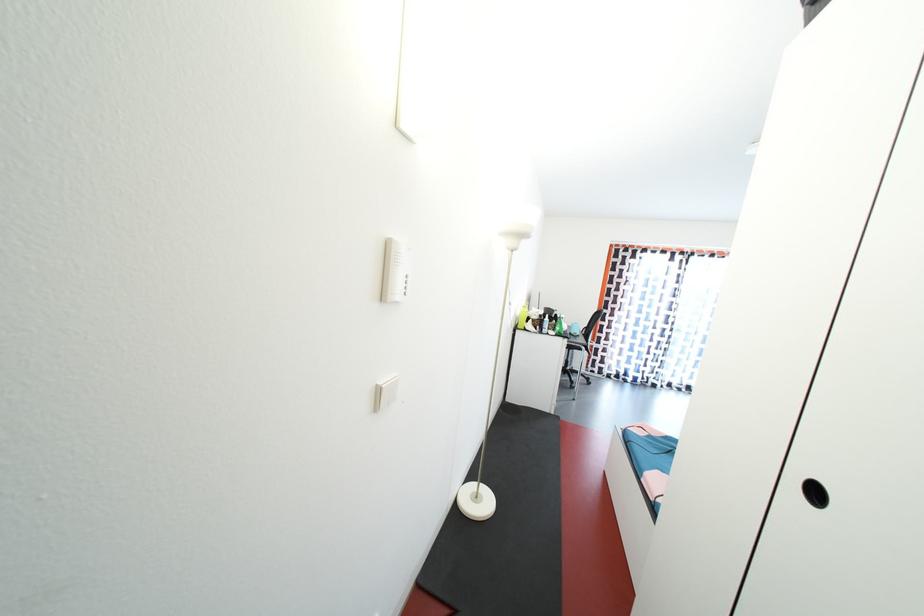
Where is `white light switch`? This screenshot has width=924, height=616. white light switch is located at coordinates (385, 392).